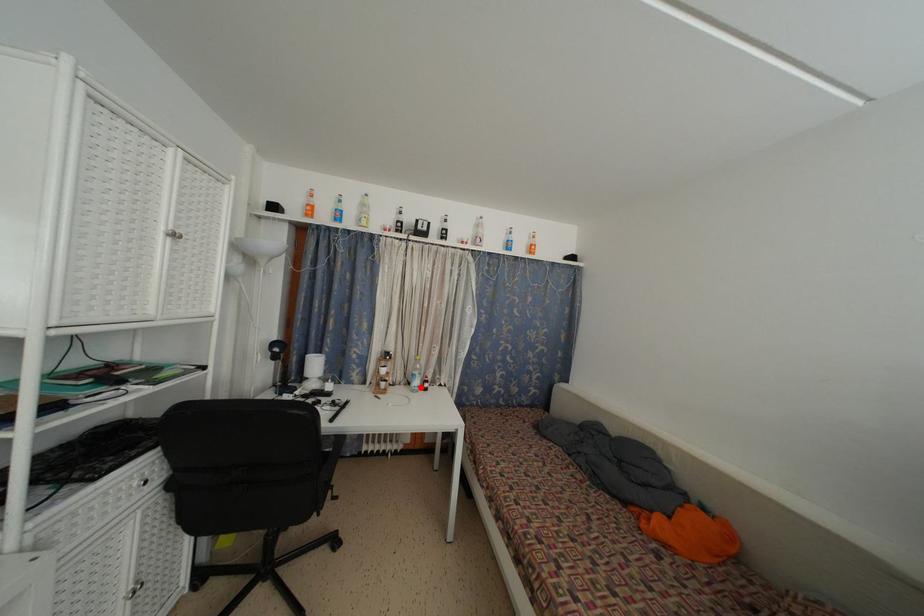
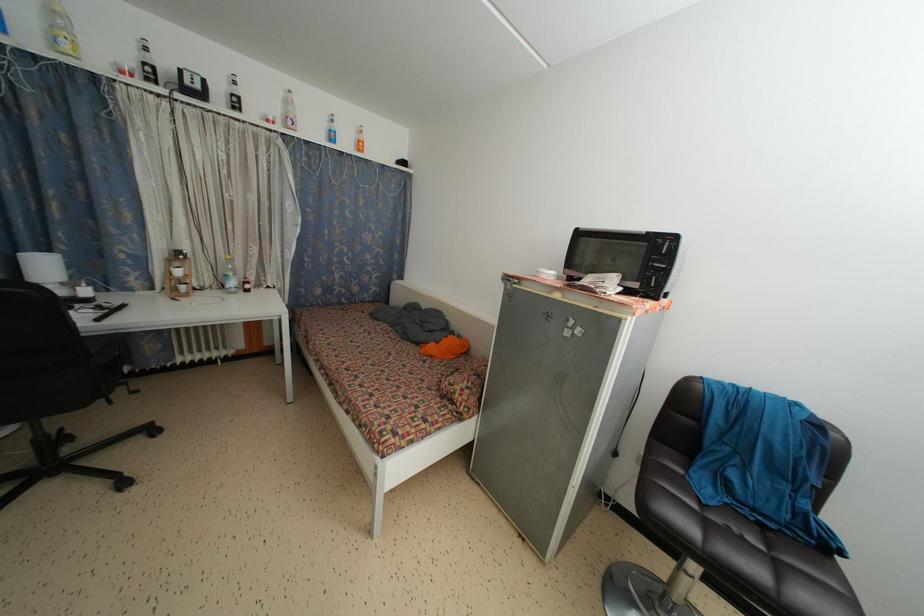
Where in the second image is the point corresponding to the highlighted location from the first image?

(237, 289)